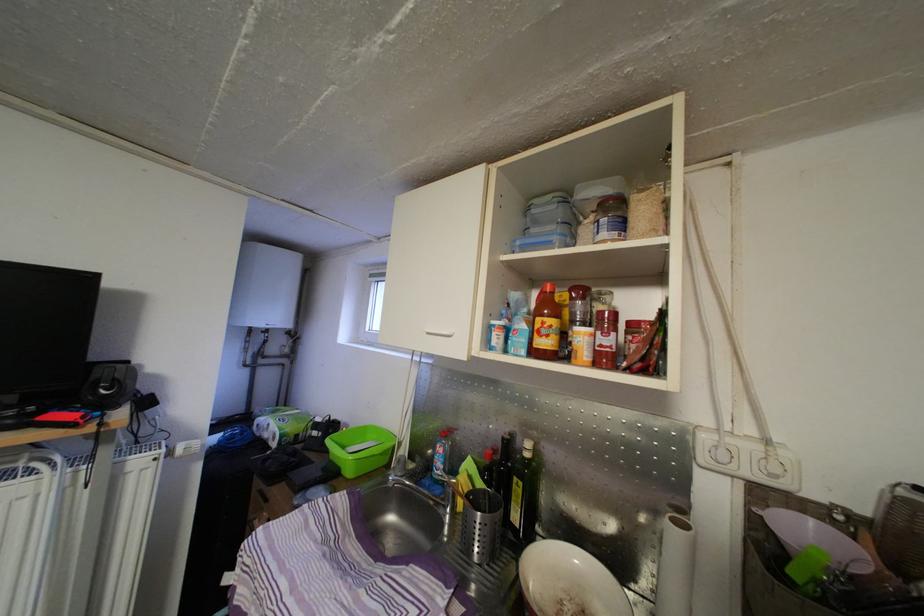
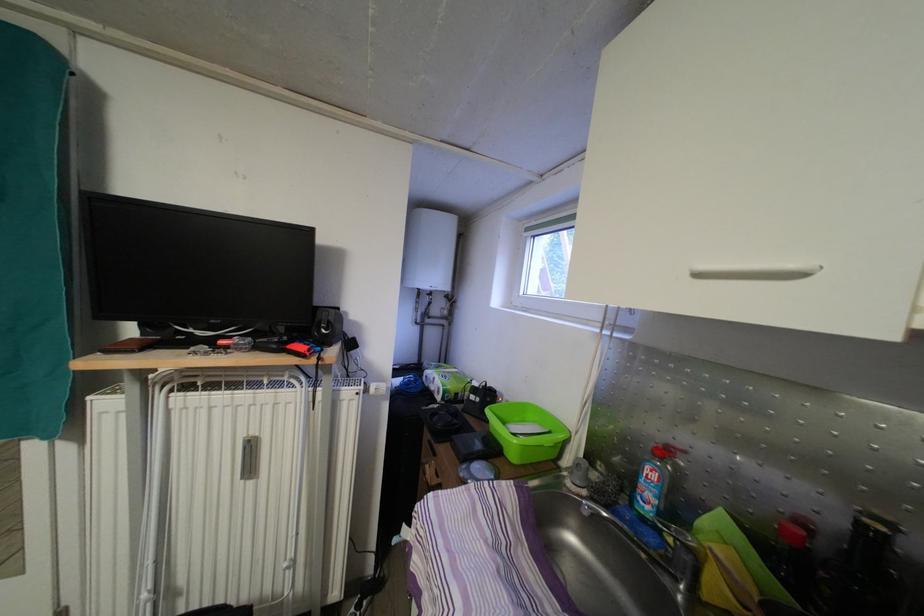
In the second image, find the point that corresponds to (300,435) in the first image.

(460, 394)